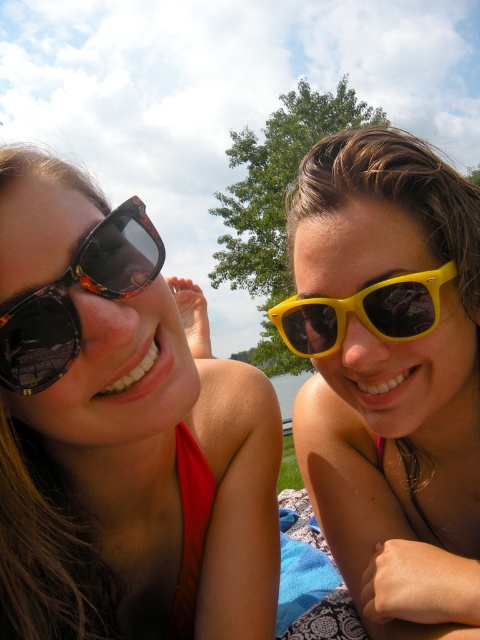
You are a photographer trying to capture a closeup of the yellow plastic sunglasses at right and the blue fabric at lower right. Which object is wider?

The yellow plastic sunglasses at right are wider than the blue fabric at lower right.

You are standing at the origin point in the image and want to throw a frisbee to a friend who is at point [90,481]. There is an obstacle at point [124,291]. Will the frisbee pass in front of or behind the obstacle?

The frisbee will pass behind the obstacle because point [90,481] is behind point [124,291] from the origin.